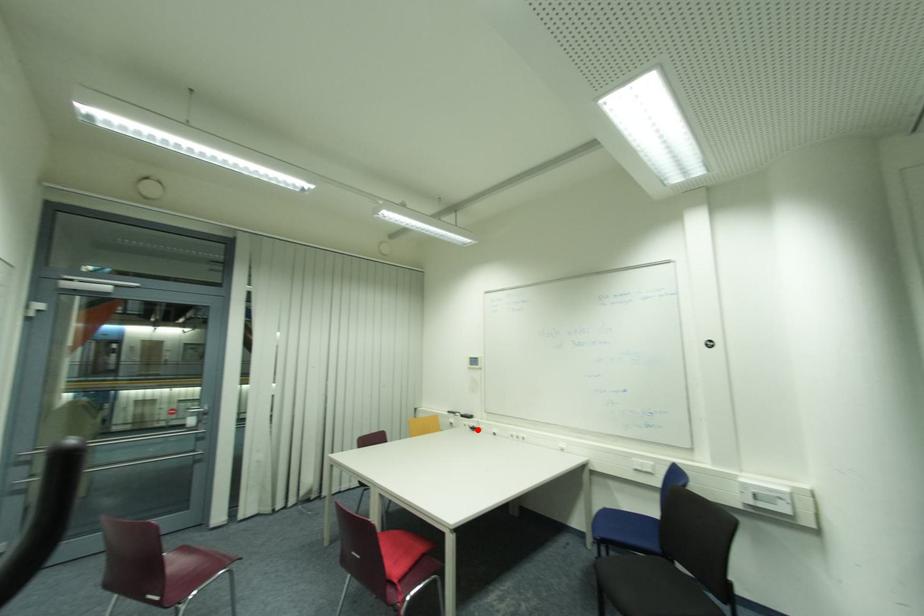
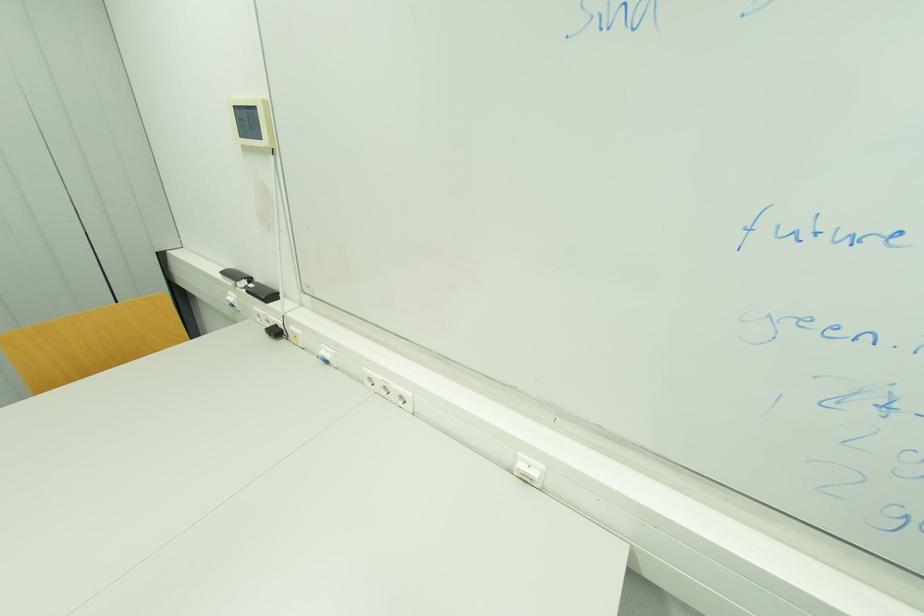
Question: I am providing you with two images of the same scene from different viewpoints. Image1 has a red point marked. In image2, the corresponding 3D location appears at what relative position? Reply with the corresponding letter.

Choices:
 (A) Closer
 (B) Farther

Answer: (A)